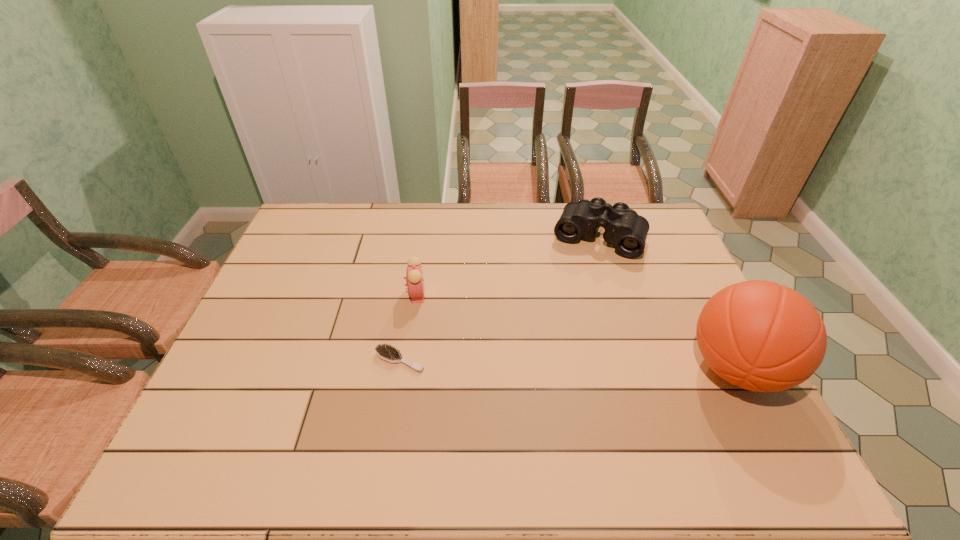
Identify the location of vacant space at the left edge of the desktop. (303, 298).

At what (x,y) coordinates should I click in order to perform the action: click on vacant area at the right edge of the desktop. Please return your answer as a coordinate pair (x, y). This screenshot has width=960, height=540. Looking at the image, I should click on (649, 279).

At what (x,y) coordinates should I click in order to perform the action: click on free space at the near left corner of the desktop. Please return your answer as a coordinate pair (x, y). Looking at the image, I should click on (254, 424).

The height and width of the screenshot is (540, 960). What are the coordinates of `vacant area between the alarm clock and the scrubbing brush` in the screenshot? It's located at (408, 327).

Locate an element on the screen. free spot between the second farthest object and the basketball is located at coordinates (577, 331).

I want to click on free spot between the tallest object and the shortest object, so click(x=568, y=364).

The width and height of the screenshot is (960, 540). Identify the location of free spot between the tallest object and the shortest object. (568, 364).

Where is `free space between the binoculars and the scrubbing brush`? The height and width of the screenshot is (540, 960). free space between the binoculars and the scrubbing brush is located at coordinates (499, 299).

At what (x,y) coordinates should I click in order to perform the action: click on free space between the tallest object and the second farthest object. Please return your answer as a coordinate pair (x, y). The width and height of the screenshot is (960, 540). Looking at the image, I should click on (577, 331).

You are a GUI agent. You are given a task and a screenshot of the screen. Output one action in this format:
    pyautogui.click(x=<x>, y=<y>)
    Task: Click on the free point between the binoculars and the shortest object
    This screenshot has width=960, height=540.
    Given the screenshot: What is the action you would take?
    coord(499,299)